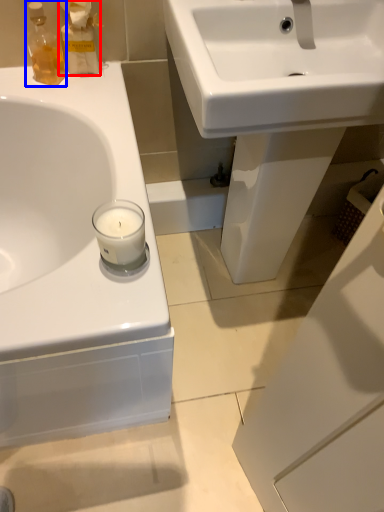
Question: Among these objects, which one is nearest to the camera, cleaning product (highlighted by a red box) or toiletry (highlighted by a blue box)?

Choices:
 (A) cleaning product
 (B) toiletry

Answer: (B)